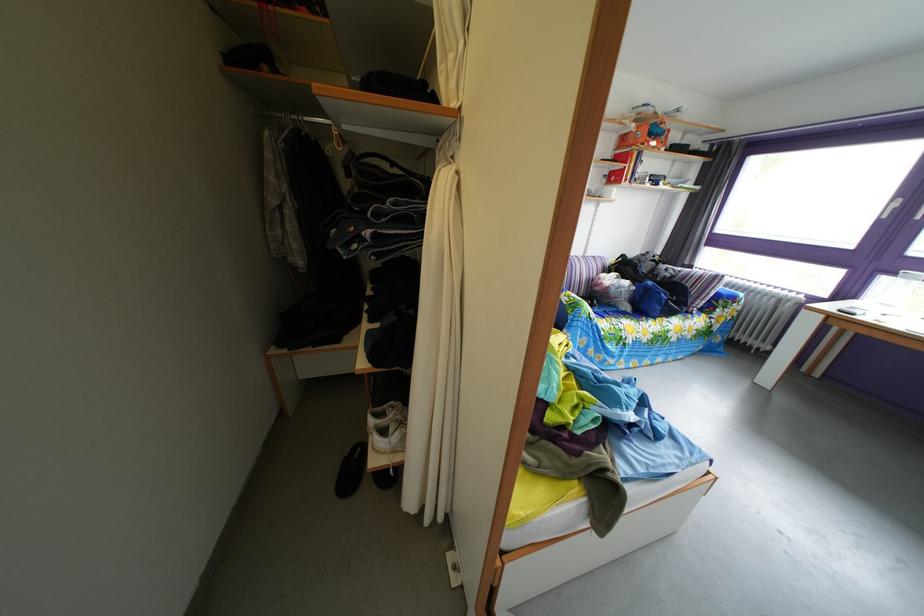
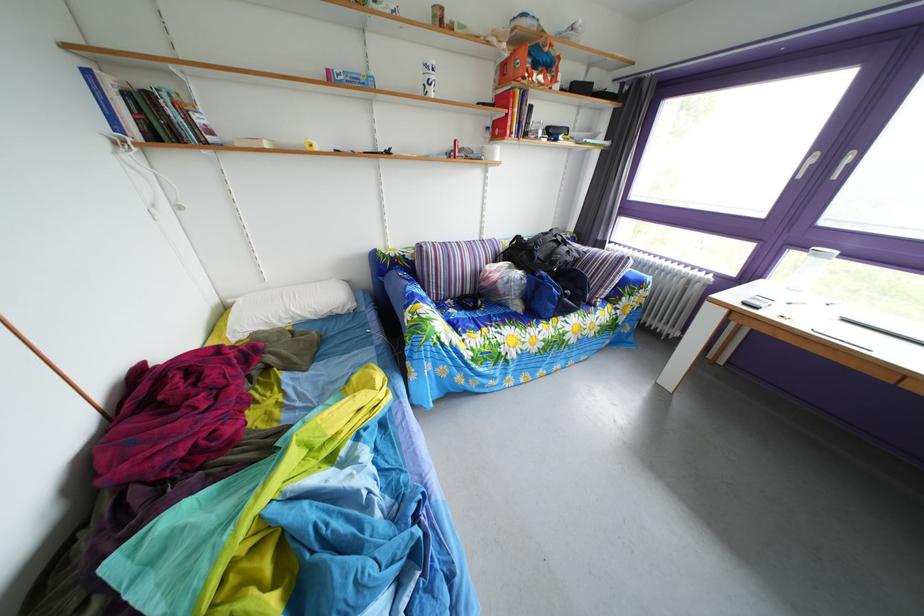
Find the pixel in the second image that matches point (634, 275) in the first image.

(529, 261)